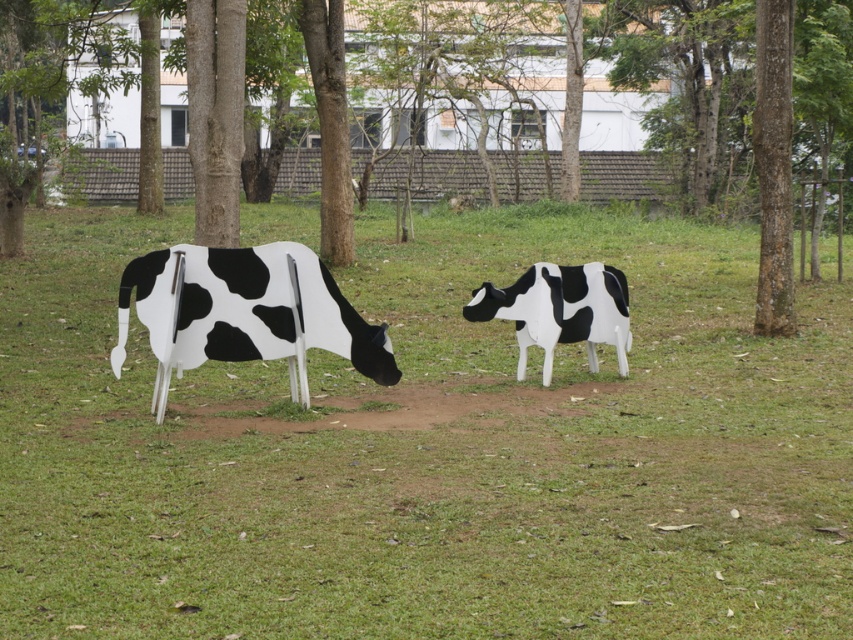
Question: Can you confirm if green grass at center is positioned to the left of black and white painted cow at left?

Choices:
 (A) yes
 (B) no

Answer: (B)

Question: Does brown textured tree at center lie in front of black and white painted cow at left?

Choices:
 (A) yes
 (B) no

Answer: (B)

Question: Which object is closer to the camera taking this photo?

Choices:
 (A) brown textured tree at center
 (B) smooth bark tree at right

Answer: (A)

Question: Is the position of smooth bark tree at center more distant than that of black and white painted cow at center?

Choices:
 (A) yes
 (B) no

Answer: (A)

Question: Considering the real-world distances, which object is closest to the green grass at center?

Choices:
 (A) brown textured tree at center
 (B) smooth bark tree at center
 (C) green leafy tree at center
 (D) smooth bark tree at right

Answer: (A)

Question: Among these objects, which one is nearest to the camera?

Choices:
 (A) black and white painted cow at left
 (B) green leafy tree at center
 (C) black and white painted cow at center

Answer: (A)